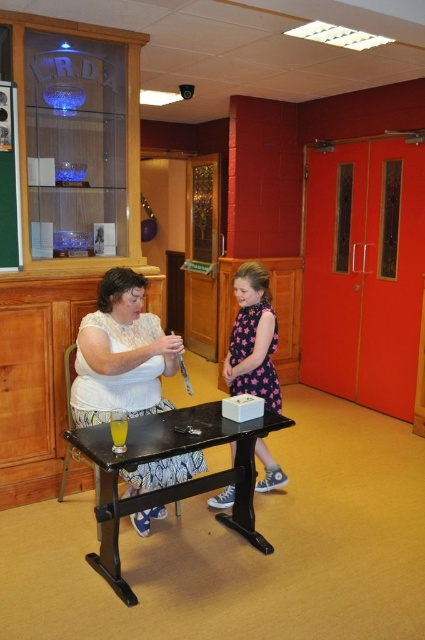
Based on the photo, you are a guest at an event and want to sit down at the black wood table at center. However, you notice the pink dotted dress at center might be in the way. Can you sit comfortably without disturbing the dress?

The black wood table at center is not as tall as the pink dotted dress at center, meaning the table is shorter than the dress. Since the dress is taller than the table, it might be hanging over the table, making it difficult to sit comfortably without disturbing it. You should check if the dress can be moved or adjust your seating position accordingly.

You are standing in the community hall and want to place a large book on the black wood table at center. Is there enough space on the table for the book?

The black wood table at center has a glass with yellow liquid and a white box with a lid on it, so there might not be enough space for the large book.

You are attending an event in this community hall and see the black wood table at center and the pink dotted dress at center. Which object is closer to the floor?

The black wood table at center is located below the pink dotted dress at center, so it is closer to the floor.